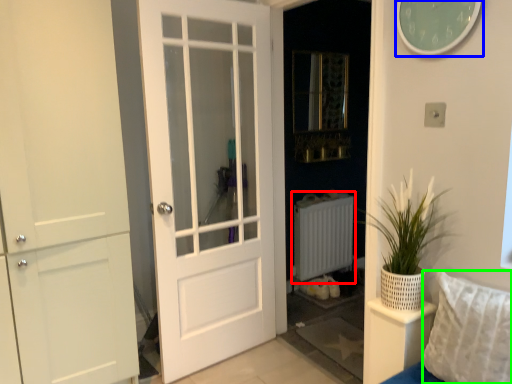
Question: Which object is the closest to the radiator (highlighted by a red box)? Choose among these: clock (highlighted by a blue box) or pillow (highlighted by a green box).

Choices:
 (A) clock
 (B) pillow

Answer: (B)